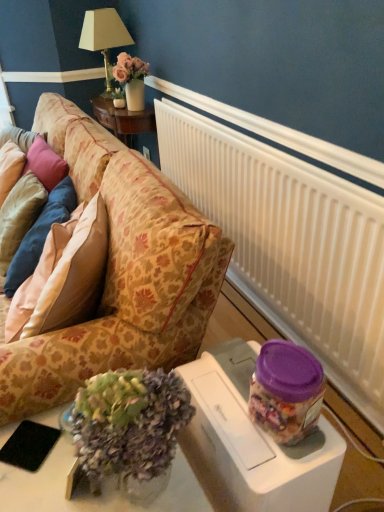
Question: Considering the positions of pink satin pillow at left, which is counted as the 2th pillow, starting from the right, and gold metallic table lamp at upper left in the image, is pink satin pillow at left, which is counted as the 2th pillow, starting from the right, wider or thinner than gold metallic table lamp at upper left?

Choices:
 (A) wide
 (B) thin

Answer: (B)

Question: Which is correct: pink satin pillow at left, which is counted as the 2th pillow, starting from the right, is inside gold metallic table lamp at upper left, or outside of it?

Choices:
 (A) inside
 (B) outside

Answer: (B)

Question: Which of these objects is positioned closest to the pink satin pillow at left, the first pillow positioned from the right?

Choices:
 (A) transparent plastic container at lower right, marked as the 2th table in a left-to-right arrangement
 (B) black matte pad at lower left
 (C) pink satin pillow at left, the second pillow from the left
 (D) white plastic radiator at upper right
 (E) gold metallic table lamp at upper left

Answer: (C)

Question: Based on their relative distances, which object is farther from the floral-patterned fabric couch at left?

Choices:
 (A) translucent glass vase at lower left
 (B) transparent plastic container at lower right, marked as the 2th table in a left-to-right arrangement
 (C) black matte pad at lower left
 (D) pink satin pillow at left, which is the 3th pillow from left to right
 (E) pink satin pillow at left, the third pillow viewed from the right

Answer: (C)